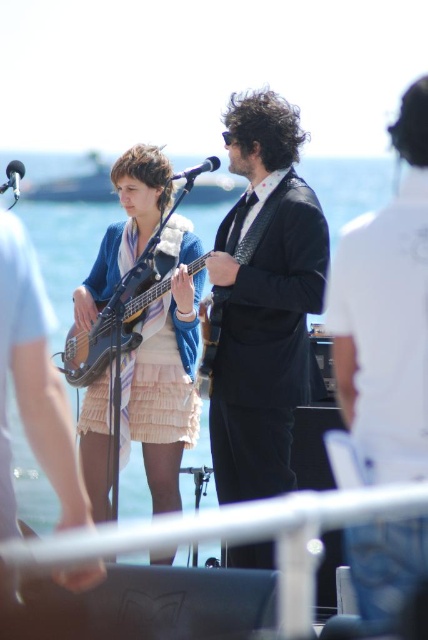
Question: Does shiny black suit at center have a greater width compared to pink ruffled skirt at center?

Choices:
 (A) yes
 (B) no

Answer: (B)

Question: Is the position of shiny black suit at center less distant than that of pink ruffled skirt at center?

Choices:
 (A) no
 (B) yes

Answer: (B)

Question: Which point is closer to the camera?

Choices:
 (A) (407, 177)
 (B) (213, 280)

Answer: (A)

Question: Among these points, which one is farthest from the camera?

Choices:
 (A) (410, 360)
 (B) (315, 300)

Answer: (B)

Question: Which of the following is the closest to the observer?

Choices:
 (A) (175, 397)
 (B) (389, 266)

Answer: (B)

Question: Is black suit at center thinner than matte black guitar at center?

Choices:
 (A) no
 (B) yes

Answer: (B)